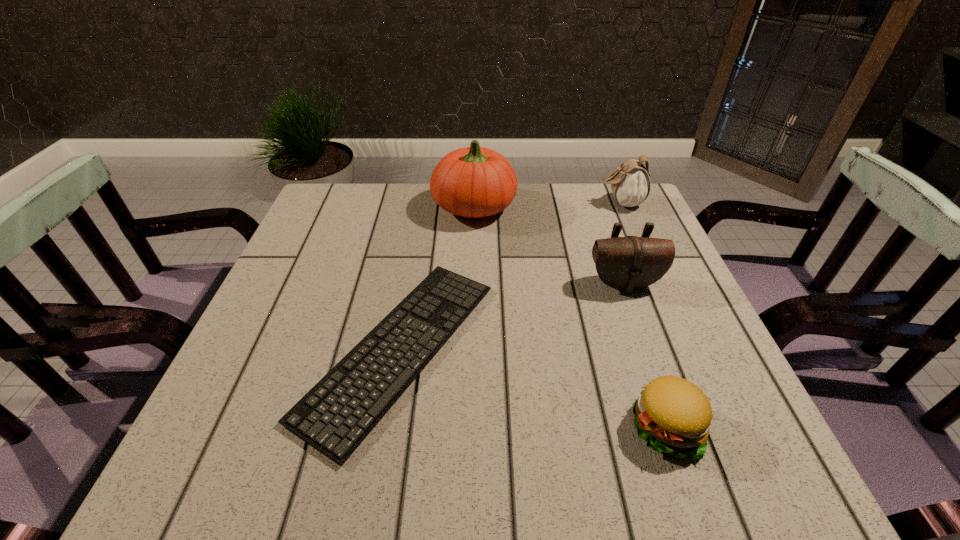
Find the location of a particular element. The image size is (960, 540). free space located 0.370m on the back of the second shortest object is located at coordinates (609, 260).

Identify the location of free space located on the back of the computer keyboard. The width and height of the screenshot is (960, 540). (424, 206).

Where is `pumpkin at the far edge`? pumpkin at the far edge is located at coordinates (474, 182).

At what (x,y) coordinates should I click in order to perform the action: click on pouch present at the far edge. Please return your answer as a coordinate pair (x, y). Image resolution: width=960 pixels, height=540 pixels. Looking at the image, I should click on (630, 183).

You are a GUI agent. You are given a task and a screenshot of the screen. Output one action in this format:
    pyautogui.click(x=<x>, y=<y>)
    Task: Click on the hamburger present at the near edge
    The width and height of the screenshot is (960, 540).
    Given the screenshot: What is the action you would take?
    pyautogui.click(x=673, y=415)

The width and height of the screenshot is (960, 540). What are the coordinates of `computer keyboard that is at the near edge` in the screenshot? It's located at (335, 416).

At what (x,y) coordinates should I click in order to perform the action: click on object that is at the left edge. Please return your answer as a coordinate pair (x, y). Looking at the image, I should click on point(335,416).

You are a GUI agent. You are given a task and a screenshot of the screen. Output one action in this format:
    pyautogui.click(x=<x>, y=<y>)
    Task: Click on the hamburger located in the right edge section of the desktop
    Image resolution: width=960 pixels, height=540 pixels.
    Given the screenshot: What is the action you would take?
    pyautogui.click(x=673, y=415)

The image size is (960, 540). Identify the location of object positioned at the near left corner. (335, 416).

Identify the location of object that is at the far right corner. (630, 183).